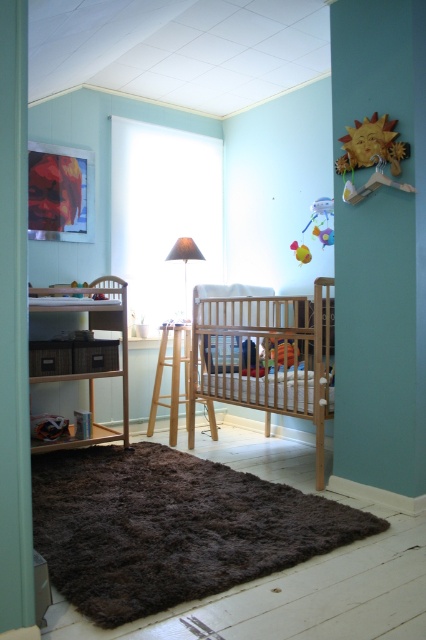
You are a parent holding a baby and standing at the entrance of the nursery. The entrance is behind you. You want to place the baby into the crib. Is the light brown wooden crib at center within your immediate reach without moving closer?

The light brown wooden crib at center is 2.84 meters away from camera. Since the parent is at the entrance, which is behind them, they would need to move closer to reach the crib as it is 2.84 meters away, which is beyond typical immediate reach distance.

You are a parent trying to place a new toy in the nursery. The nursery has a light brown wooden crib at center and a plastic multicolored toy at upper right. Which object takes up more space in the room?

The light brown wooden crib at center is bigger than the plastic multicolored toy at upper right, so it takes up more space in the room.

You are a parent entering the nursery and want to place a new toy on the wooden sun at upper right. Can you reach it from your current position near the light brown wooden crib at center?

The light brown wooden crib at center is below the wooden sun at upper right, so the wooden sun at upper right is higher up. If you are near the crib, you might need a step stool to reach the wooden sun at upper right.